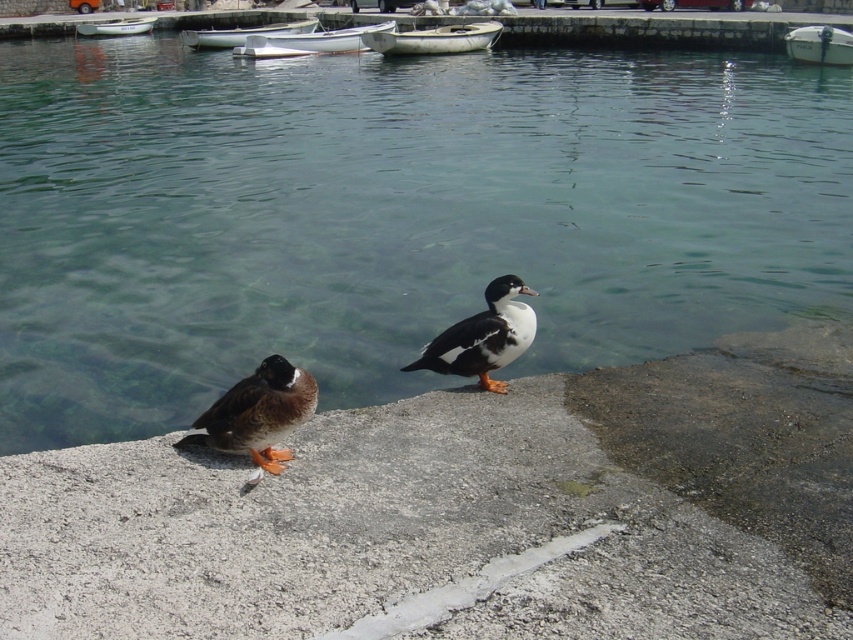
You are a small toy boat that needs to navigate from the gray concrete at center to the white plastic boat at upper left. Considering their heights, which path would be easier for you to take?

The gray concrete at center has a lesser height compared to the white plastic boat at upper left, so navigating from the gray concrete at center to the white plastic boat at upper left might require ascending, making the path from the gray concrete at center to the white plastic boat at upper left more challenging. However, since the white plastic boat at upper left is higher, the reverse path from the white plastic boat at upper left to the gray concrete at center would be easier as it involves descending.

You are standing at the point marked as point [722,88] in the image. There is a boat in the background. Can you see the boat from your current position?

The point [722,88] is 22.40 meters away from the viewer. Since the boat is in the background, it should be visible from that position.

You are a photographer trying to capture a closeup shot of the brown feathered duck at lower left and the white wooden boat at center. Which object will require you to zoom in more to fill the frame, considering their sizes?

The brown feathered duck at lower left is thinner than the white wooden boat at center, so you will need to zoom in more to fill the frame when photographing the brown feathered duck at lower left because it is smaller in size.